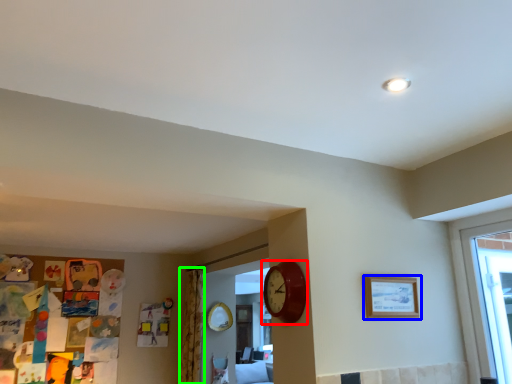
Question: Which object is the closest to the wall clock (highlighted by a red box)? Choose among these: picture frame (highlighted by a blue box) or curtain (highlighted by a green box).

Choices:
 (A) picture frame
 (B) curtain

Answer: (A)